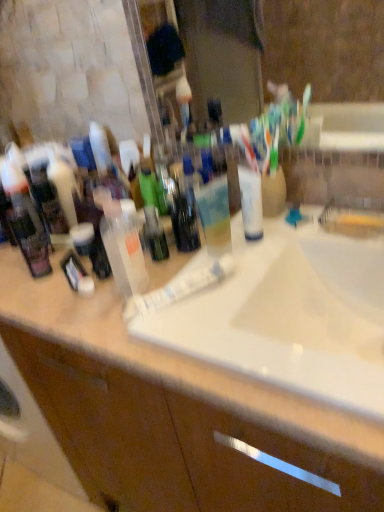
Where is `vacant space that is to the left of white matte jar at center-left, the second toiletry viewed from the right`? vacant space that is to the left of white matte jar at center-left, the second toiletry viewed from the right is located at coordinates (24, 271).